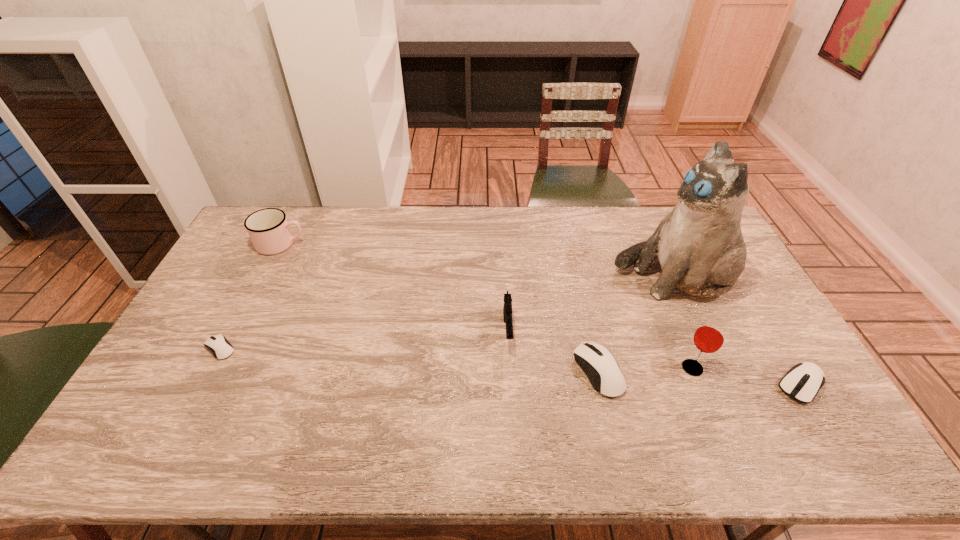
Find the location of `the shortest mouse`. the shortest mouse is located at coordinates (220, 347).

You are a GUI agent. You are given a task and a screenshot of the screen. Output one action in this format:
    pyautogui.click(x=<x>, y=<y>)
    Task: Click on the leftmost mouse
    This screenshot has height=540, width=960.
    Given the screenshot: What is the action you would take?
    pyautogui.click(x=220, y=347)

What are the coordinates of `the second mouse from right to left` in the screenshot? It's located at (598, 363).

Identify the location of the second shortest object. The height and width of the screenshot is (540, 960). (802, 382).

I want to click on the second shortest mouse, so click(x=802, y=382).

The height and width of the screenshot is (540, 960). Identify the location of mug. (268, 228).

Find the location of a particular element. cat is located at coordinates pyautogui.click(x=701, y=250).

The width and height of the screenshot is (960, 540). What are the coordinates of `glass` in the screenshot? It's located at (709, 337).

The height and width of the screenshot is (540, 960). What are the coordinates of `pistol` in the screenshot? It's located at (507, 308).

Image resolution: width=960 pixels, height=540 pixels. Identify the location of free point located on the back of the shortest mouse. 263,267.